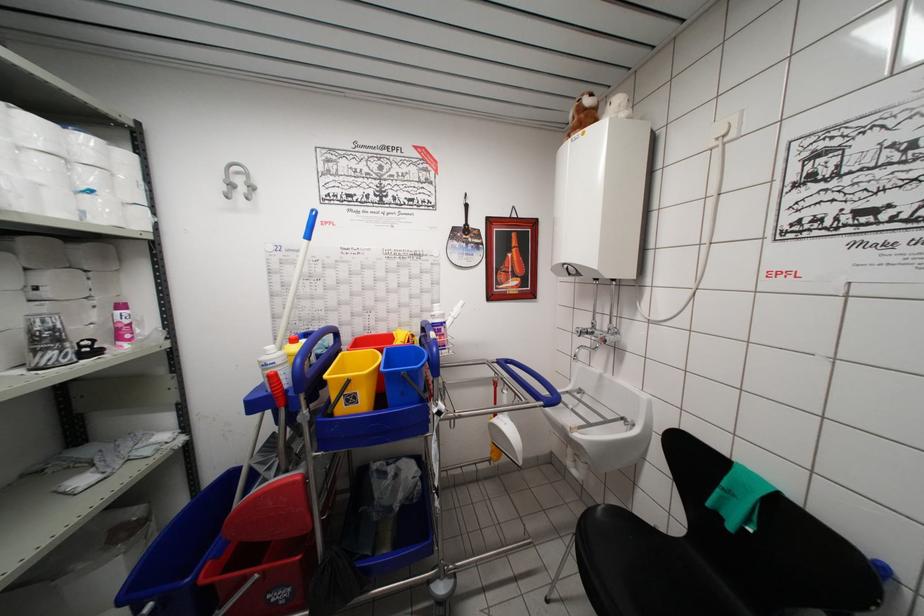
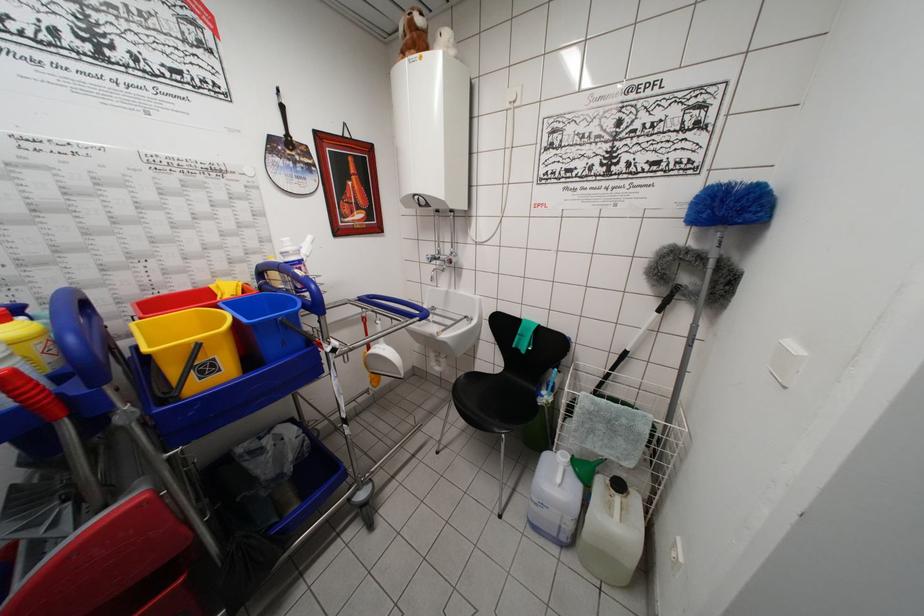
In the second image, find the point that corresponds to point 580,336 in the first image.

(432, 262)